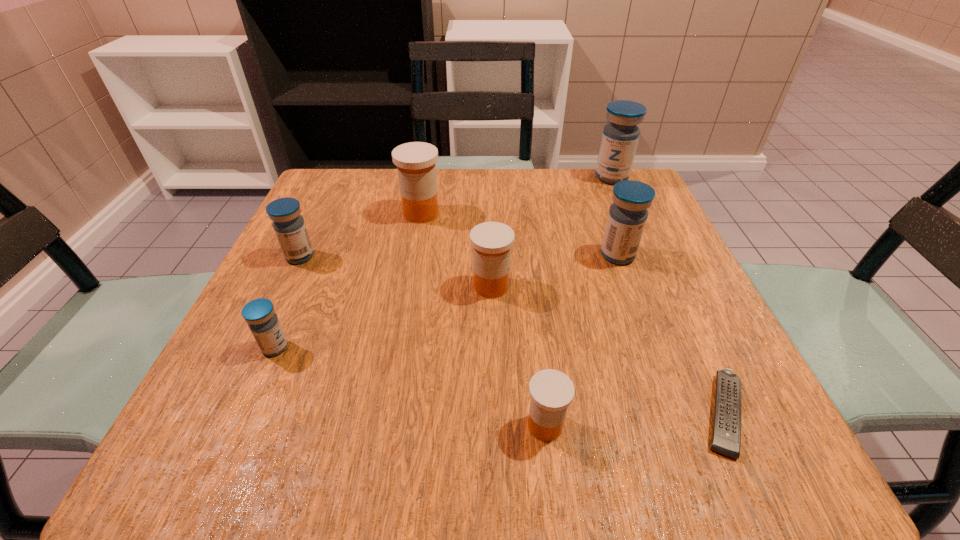
The width and height of the screenshot is (960, 540). What are the coordinates of `the fifth medicine from left to right` in the screenshot? It's located at (551, 391).

This screenshot has width=960, height=540. What are the coordinates of `the nearest orange medicine` in the screenshot? It's located at (551, 391).

Image resolution: width=960 pixels, height=540 pixels. In order to click on remote control in this screenshot , I will do `click(726, 434)`.

Locate an element on the screen. vacant area situated on the left of the tallest object is located at coordinates (566, 178).

Identify the location of free space located on the label of the sixth nearest medicine. (398, 342).

Locate an element on the screen. The image size is (960, 540). vacant space situated 0.280m on the back of the third smallest blue medicine is located at coordinates (588, 177).

Identify the location of vacant space situated 0.320m on the label of the fifth farthest medicine. (300, 286).

Locate an element on the screen. This screenshot has width=960, height=540. vacant space located 0.210m on the label of the fifth farthest medicine is located at coordinates (358, 286).

The height and width of the screenshot is (540, 960). I want to click on vacant space located 0.270m on the label of the fifth farthest medicine, so point(325,286).

Locate an element on the screen. Image resolution: width=960 pixels, height=540 pixels. vacant space located on the back of the third biggest blue medicine is located at coordinates coord(328,196).